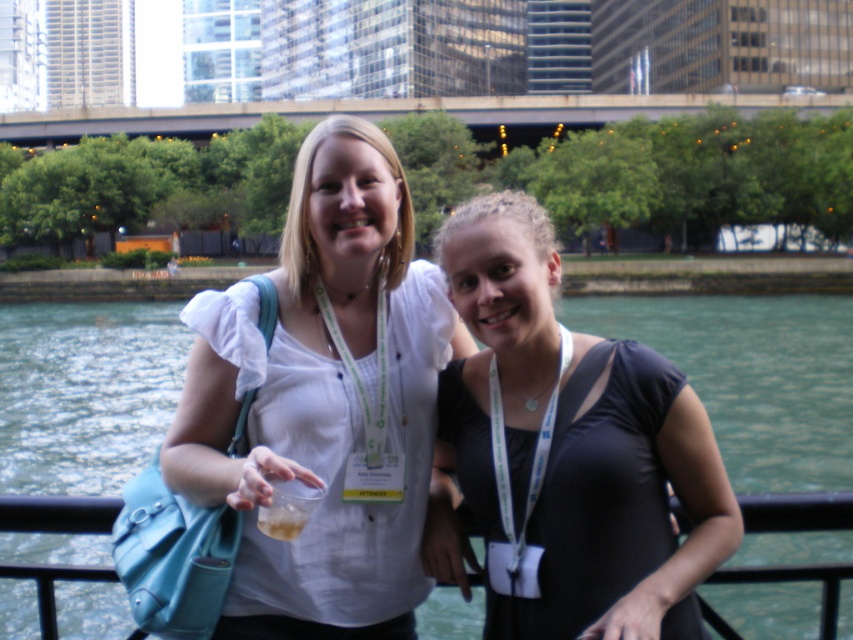
Looking at this image, you are a photographer planning to take a group photo of the two people in the scene. The green water at river right and the black matte dress at center are both visible in the background. Which object is positioned higher in the frame?

The green water at river right is much taller as black matte dress at center, so it is positioned higher in the frame.

Looking at this image, you are a photographer who needs to capture a closeup shot of the black matte dress at center. According to the coordinates provided, where should you position your camera to ensure the dress is centered in the frame?

Position the camera at the coordinates point (570,449) to center the black matte dress at center in the frame.